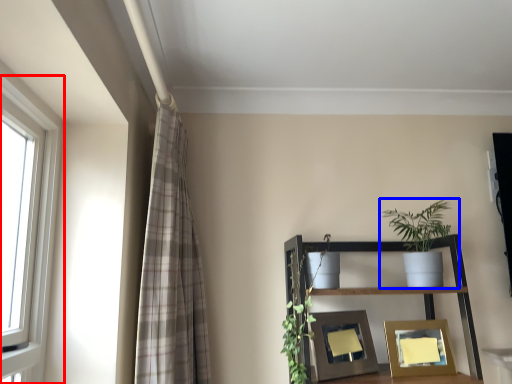
Question: Which object is closer to the camera taking this photo, window (highlighted by a red box) or houseplant (highlighted by a blue box)?

Choices:
 (A) window
 (B) houseplant

Answer: (A)